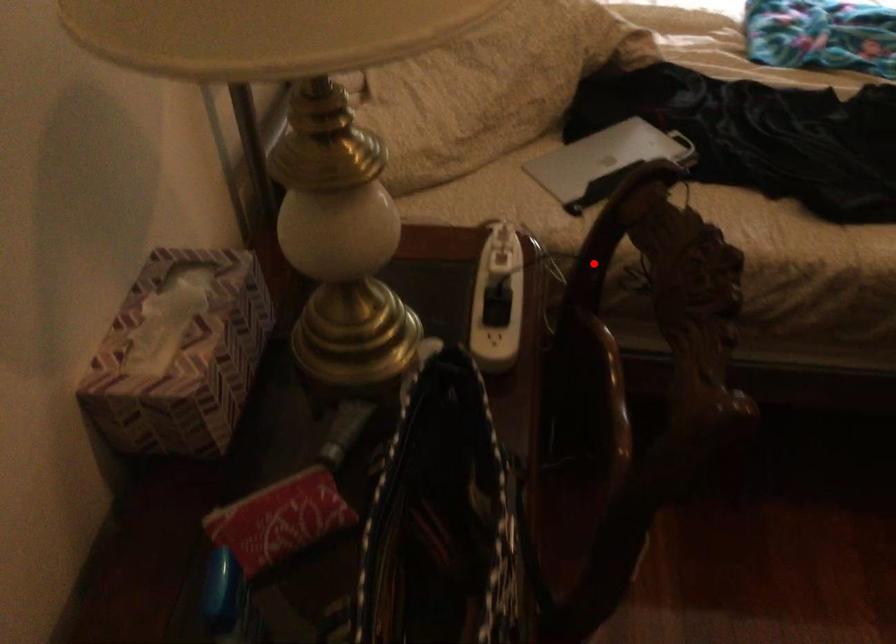
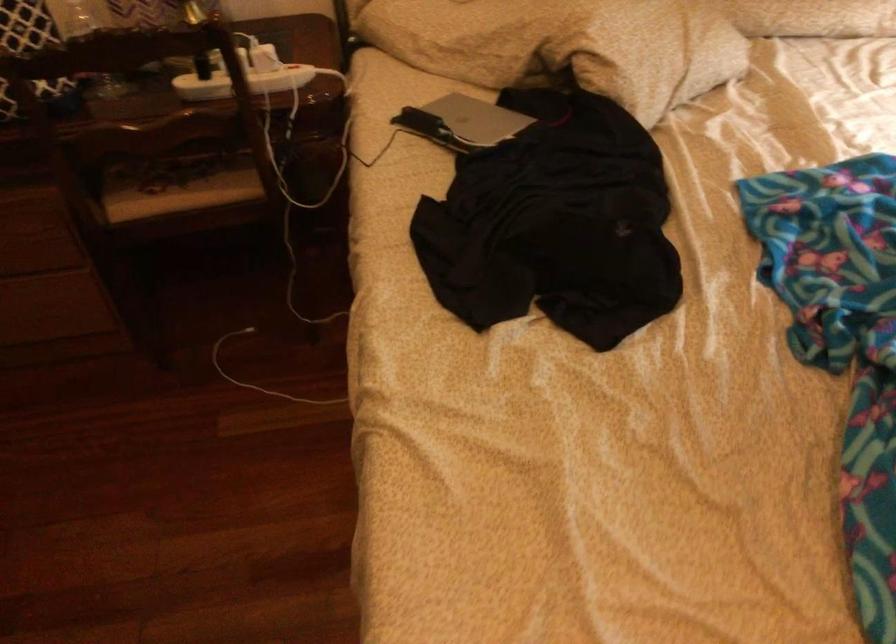
Find the pixel in the second image that matches the highlighted location in the first image.

(243, 82)